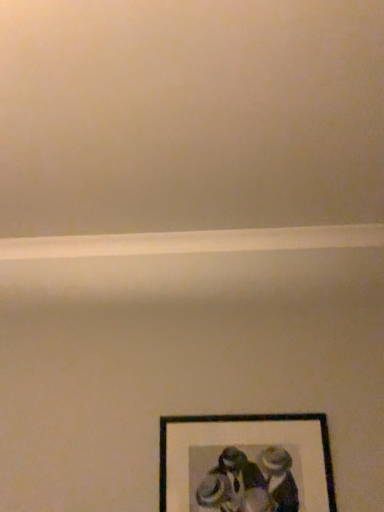
Question: Should I look upward or downward to see black matte picture frame at lower center?

Choices:
 (A) down
 (B) up

Answer: (A)